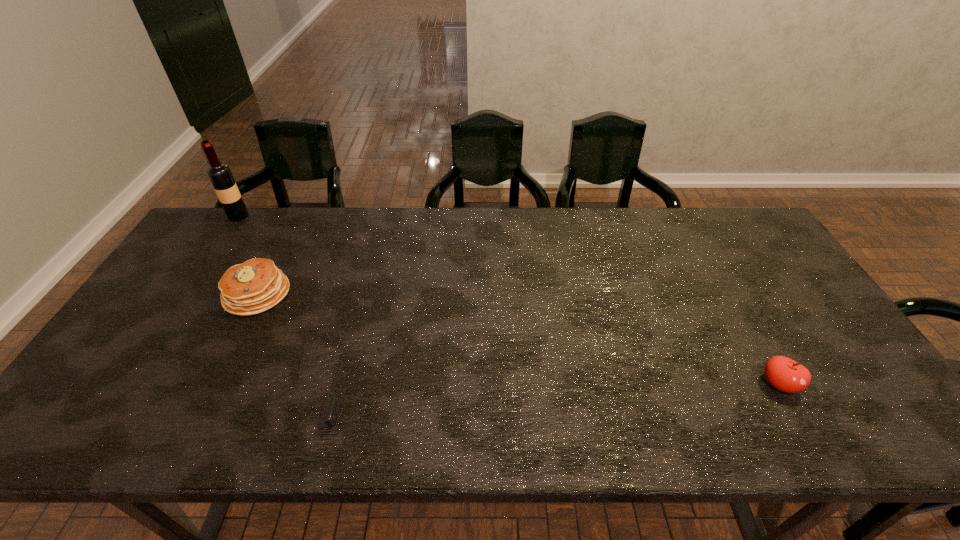
The image size is (960, 540). In order to click on the leftmost object in this screenshot , I will do `click(219, 174)`.

You are a GUI agent. You are given a task and a screenshot of the screen. Output one action in this format:
    pyautogui.click(x=<x>, y=<y>)
    Task: Click on the tallest object
    The height and width of the screenshot is (540, 960).
    Given the screenshot: What is the action you would take?
    pyautogui.click(x=219, y=174)

Identify the location of the second farthest object. The width and height of the screenshot is (960, 540). (257, 285).

Identify the location of the second object from left to right. (257, 285).

This screenshot has width=960, height=540. What are the coordinates of `the rightmost object` in the screenshot? It's located at (784, 374).

Find the location of a particular element. This screenshot has height=540, width=960. apple is located at coordinates (784, 374).

Locate an element on the screen. The image size is (960, 540). the third object from left to right is located at coordinates click(x=329, y=413).

Where is `the nearest object`? the nearest object is located at coordinates (329, 413).

Find the location of `vacant space positioned on the right of the leftmost object`. vacant space positioned on the right of the leftmost object is located at coordinates (271, 216).

Locate an element on the screen. The height and width of the screenshot is (540, 960). blank area located on the back of the pancake is located at coordinates (293, 222).